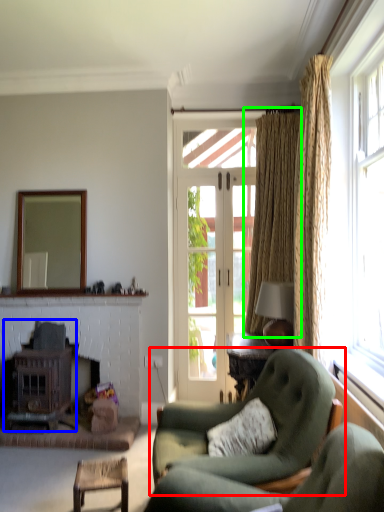
Question: Estimate the real-world distances between objects in this image. Which object is farther from chair (highlighted by a red box), stove (highlighted by a blue box) or curtain (highlighted by a green box)?

Choices:
 (A) stove
 (B) curtain

Answer: (B)